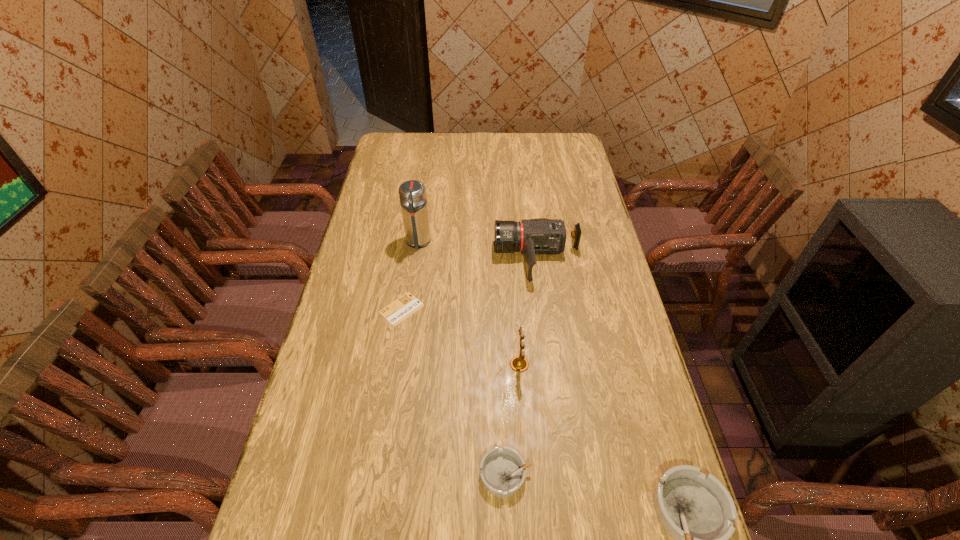
Identify the location of the shorter ashtray. (503, 471).

Locate an element on the screen. the second shortest object is located at coordinates (503, 471).

You are a GUI agent. You are given a task and a screenshot of the screen. Output one action in this format:
    pyautogui.click(x=<x>, y=<y>)
    Task: Click on the fourth shortest object
    The image size is (960, 540).
    Given the screenshot: What is the action you would take?
    pyautogui.click(x=540, y=235)

Locate an element on the screen. This screenshot has width=960, height=540. the shortest object is located at coordinates (396, 312).

I want to click on the fourth nearest object, so click(x=396, y=312).

The image size is (960, 540). In order to click on thermos bottle in this screenshot , I will do `click(412, 193)`.

Locate an element on the screen. This screenshot has width=960, height=540. the third nearest object is located at coordinates (519, 363).

Locate an element on the screen. The height and width of the screenshot is (540, 960). candelabrum is located at coordinates (519, 363).

You are a GUI agent. You are given a task and a screenshot of the screen. Output one action in this format:
    pyautogui.click(x=<x>, y=<y>)
    Task: Click on the vacant space located on the back of the fifth tallest object
    
    Given the screenshot: What is the action you would take?
    tap(503, 406)

Where is `vacant region located 0.100m on the lens of the camcorder`? vacant region located 0.100m on the lens of the camcorder is located at coordinates (467, 259).